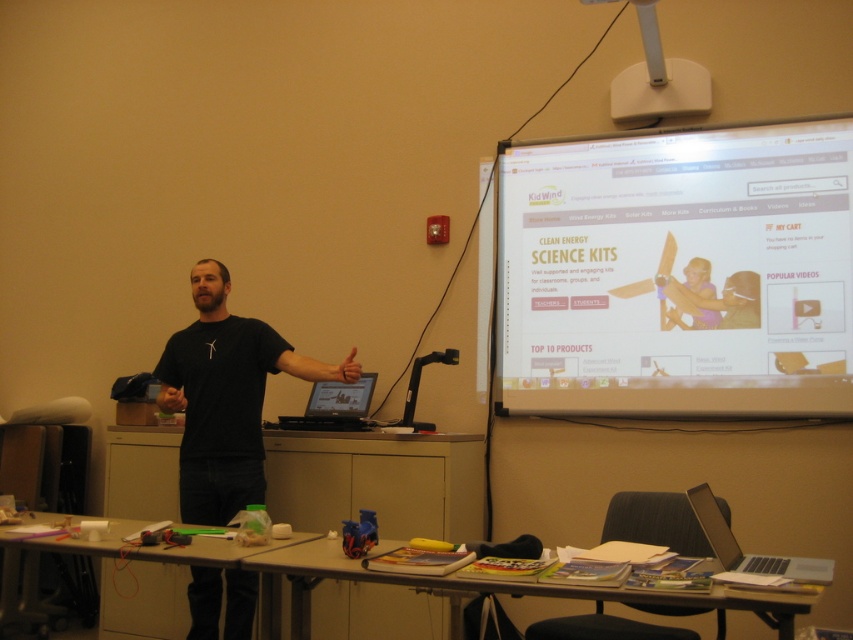
Question: Does white plastic projector at upper center have a lesser width compared to silver metallic laptop at lower right?

Choices:
 (A) yes
 (B) no

Answer: (B)

Question: Which object is closer to the camera taking this photo?

Choices:
 (A) wooden at lower left
 (B) black matte shirt at center

Answer: (A)

Question: Estimate the real-world distances between objects in this image. Which object is farther from the white glossy projection screen at upper right?

Choices:
 (A) wooden table at lower center
 (B) silver metallic laptop at lower right
 (C) black matte shirt at center

Answer: (A)

Question: Is black matte shirt at center closer to the viewer compared to white plastic projector at upper center?

Choices:
 (A) yes
 (B) no

Answer: (A)

Question: Is wooden table at lower center closer to camera compared to white plastic projector at upper center?

Choices:
 (A) no
 (B) yes

Answer: (B)

Question: Which object is the closest to the black matte shirt at center?

Choices:
 (A) wooden table at lower center
 (B) white glossy projection screen at upper right
 (C) silver metallic laptop at lower right
 (D) wooden at lower left

Answer: (D)